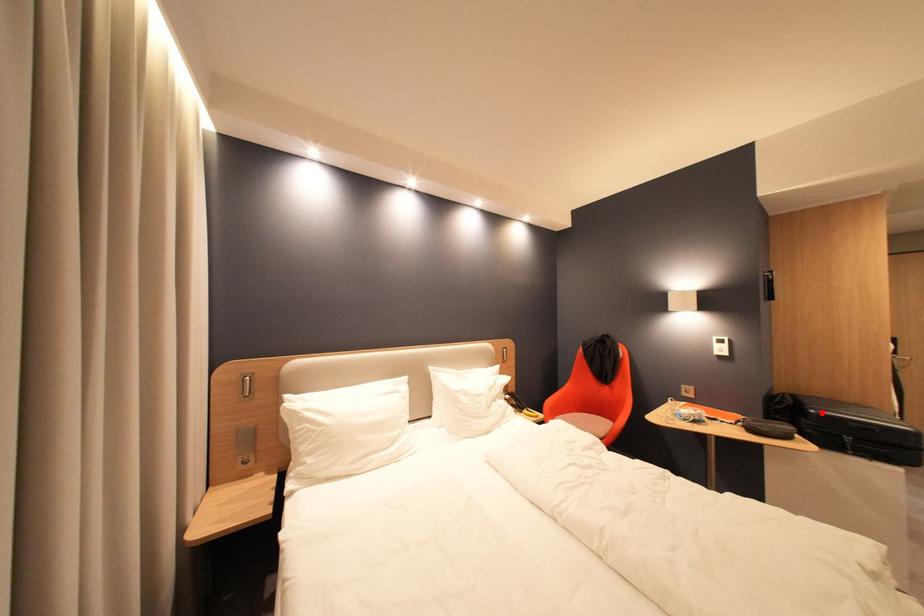
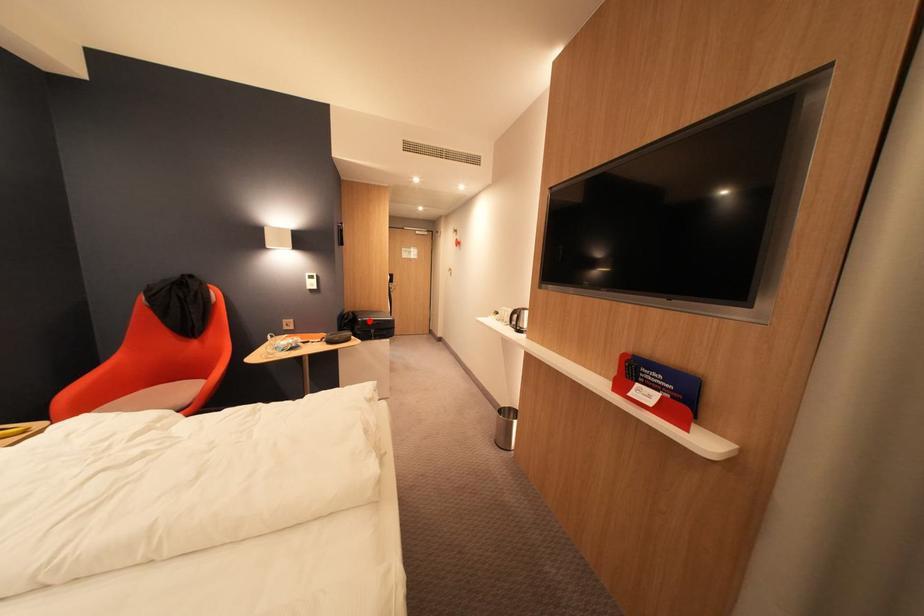
I am providing you with two images of the same scene from different viewpoints. A red point is marked on the first image and another point is marked on the second image. Does the point marked in image1 correspond to the same location as the one in image2?

Yes